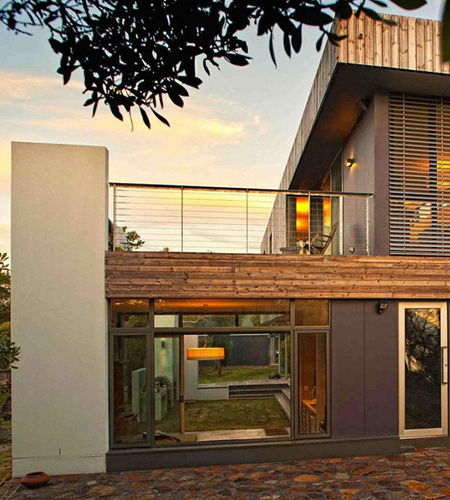
You are a GUI agent. You are given a task and a screenshot of the screen. Output one action in this format:
    pyautogui.click(x=<x>, y=<y>)
    Task: Click on the window
    
    Given the screenshot: What is the action you would take?
    pyautogui.click(x=263, y=354)